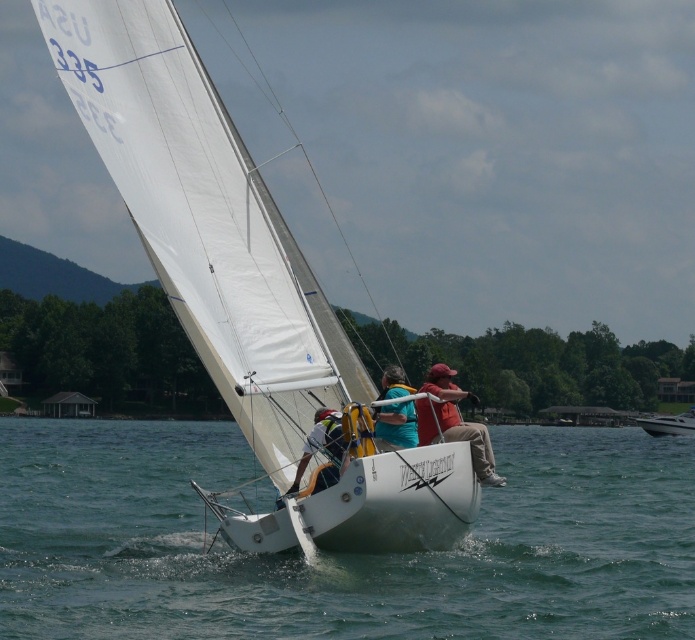
Question: Which object is closer to the camera taking this photo?

Choices:
 (A) white glossy boat at right
 (B) white matte sailboat at center
 (C) blue fabric sail at center

Answer: (B)

Question: Is the position of blue fabric sail at center more distant than that of white glossy boat at right?

Choices:
 (A) no
 (B) yes

Answer: (A)

Question: Does clear blue water at center appear over red fabric cap at center?

Choices:
 (A) yes
 (B) no

Answer: (B)

Question: Can you confirm if red fabric cap at center is thinner than white glossy boat at right?

Choices:
 (A) no
 (B) yes

Answer: (B)

Question: Which of the following is the farthest from the observer?

Choices:
 (A) white glossy boat at right
 (B) red fabric cap at center

Answer: (A)

Question: Which object is the farthest from the blue fabric sail at center?

Choices:
 (A) white matte sailboat at center
 (B) red fabric cap at center
 (C) clear blue water at center
 (D) white glossy boat at right

Answer: (D)